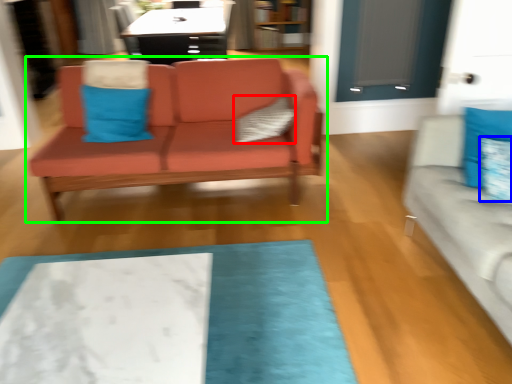
Question: Which is farther away from pillow (highlighted by a red box)? pillow (highlighted by a blue box) or studio couch (highlighted by a green box)?

Choices:
 (A) pillow
 (B) studio couch

Answer: (A)